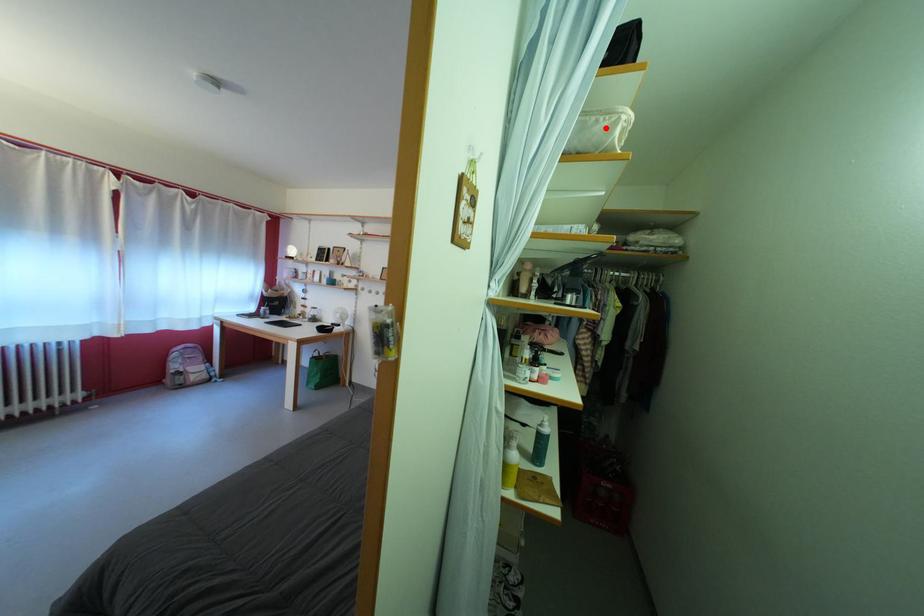
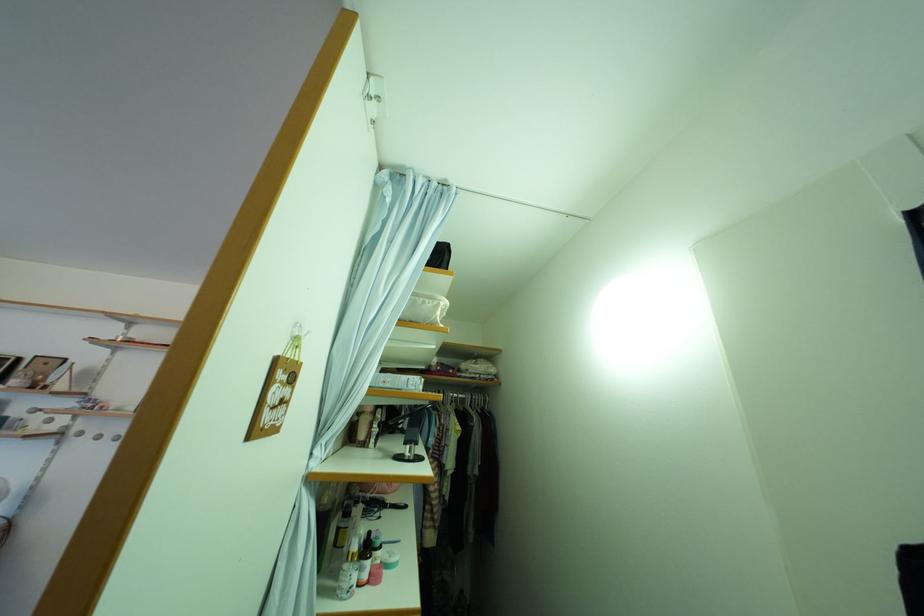
Find the pixel in the second image that matches the highlighted location in the first image.

(432, 309)